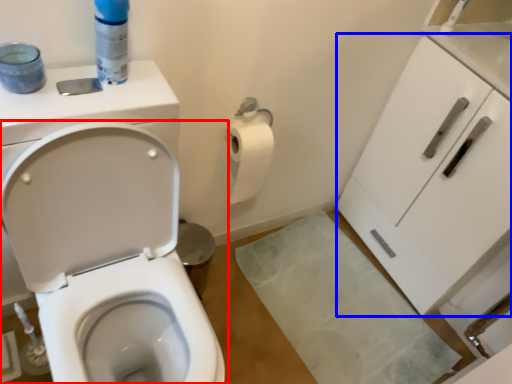
Question: Which point is closer to the camera, toilet (highlighted by a red box) or cabinetry (highlighted by a blue box)?

Choices:
 (A) toilet
 (B) cabinetry

Answer: (A)